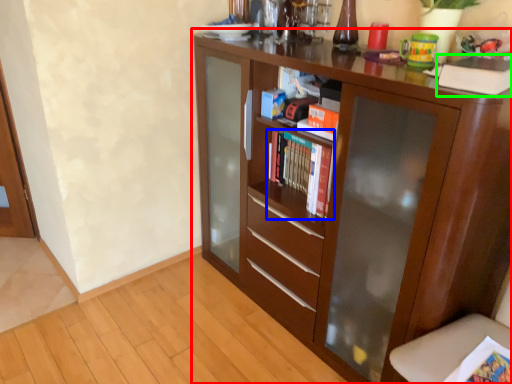
Question: Which is nearer to the cupboard (highlighted by a red box)? book (highlighted by a blue box) or paperback book (highlighted by a green box).

Choices:
 (A) book
 (B) paperback book

Answer: (A)